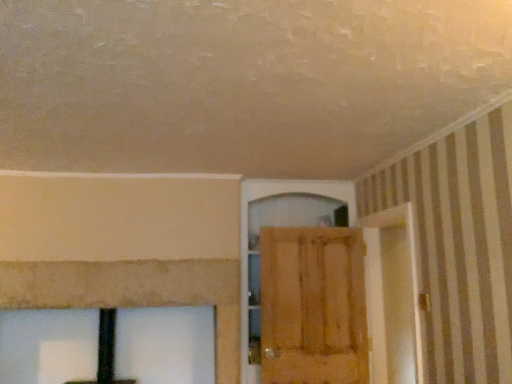
Locate an element on the screen. This screenshot has width=512, height=384. wooden door at center is located at coordinates (313, 306).

Describe the element at coordinates (313, 306) in the screenshot. I see `wooden door at center` at that location.

You are a GUI agent. You are given a task and a screenshot of the screen. Output one action in this format:
    pyautogui.click(x=<x>, y=<y>)
    Task: Click on the wooden screen door at right
    
    Given the screenshot: What is the action you would take?
    pyautogui.click(x=393, y=296)

The height and width of the screenshot is (384, 512). What do you see at coordinates (393, 296) in the screenshot?
I see `wooden screen door at right` at bounding box center [393, 296].

Find the location of a particular element. Image resolution: width=512 pixels, height=384 pixels. wooden door at center is located at coordinates (313, 306).

Is wooden door at center to the right of wooden screen door at right from the viewer's perspective?

No, wooden door at center is not to the right of wooden screen door at right.

Is the depth of wooden door at center less than that of wooden screen door at right?

No, wooden door at center is further to the viewer.

Is point (297, 363) behind point (388, 238)?

No, it is in front of (388, 238).

From the image's perspective, who appears lower, wooden door at center or wooden screen door at right?

wooden door at center.

From a real-world perspective, is wooden door at center located higher than wooden screen door at right?

Incorrect, from a real-world perspective, wooden door at center is lower than wooden screen door at right.

Based on the photo, considering the sizes of objects wooden door at center and wooden screen door at right in the image provided, who is wider, wooden door at center or wooden screen door at right?

With larger width is wooden screen door at right.

From their relative heights in the image, would you say wooden door at center is taller or shorter than wooden screen door at right?

In the image, wooden door at center appears to be shorter than wooden screen door at right.

Is wooden door at center smaller than wooden screen door at right?

Yes, wooden door at center is smaller than wooden screen door at right.

Is wooden door at center positioned beyond the bounds of wooden screen door at right?

wooden door at center lies outside wooden screen door at right's area.

Is wooden door at center touching wooden screen door at right?

wooden door at center and wooden screen door at right are clearly separated.

From the picture: Is wooden door at center facing towards wooden screen door at right?

Yes, wooden door at center faces towards wooden screen door at right.

This screenshot has height=384, width=512. I want to click on screen door on the right of the wooden door at center, so click(393, 296).

Can you confirm if wooden screen door at right is positioned to the right of wooden door at center?

Correct, you'll find wooden screen door at right to the right of wooden door at center.

Considering their positions, is wooden screen door at right located in front of or behind wooden door at center?

Clearly, wooden screen door at right is in front of wooden door at center.

Which is closer, [411,259] or [272,289]?

Point [411,259]

Looking at this image, from the image's perspective, which one is positioned higher, wooden screen door at right or wooden door at center?

From the image's view, wooden screen door at right is above.

From a real-world perspective, is wooden screen door at right positioned above or below wooden door at center?

From a real-world perspective, wooden screen door at right is physically above wooden door at center.

Is wooden screen door at right wider than wooden door at center?

Yes.

Who is shorter, wooden screen door at right or wooden door at center?

wooden door at center.

Considering the relative sizes of wooden screen door at right and wooden door at center in the image provided, is wooden screen door at right bigger than wooden door at center?

Indeed, wooden screen door at right has a larger size compared to wooden door at center.

Is wooden screen door at right not inside wooden door at center?

Yes.

Is wooden screen door at right with wooden door at center?

No, wooden screen door at right is not making contact with wooden door at center.

Is wooden door at center at the back of wooden screen door at right?

wooden screen door at right does not have its back to wooden door at center.

What's the angular difference between wooden screen door at right and wooden door at center's facing directions?

The angular difference between wooden screen door at right and wooden door at center is 86.1 degrees.

How distant is wooden screen door at right from wooden door at center?

The distance of wooden screen door at right from wooden door at center is 16.43 inches.

The width and height of the screenshot is (512, 384). I want to click on screen door on the right of wooden door at center, so click(393, 296).

At what (x,y) coordinates should I click in order to perform the action: click on door lying below the wooden screen door at right (from the image's perspective). Please return your answer as a coordinate pair (x, y). This screenshot has height=384, width=512. Looking at the image, I should click on [313, 306].

In order to click on screen door that appears on the right of wooden door at center in this screenshot , I will do `click(393, 296)`.